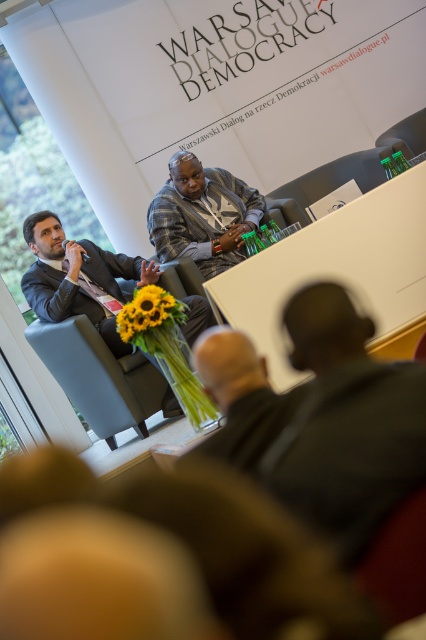
You are organizing a photo shoot for a fashion magazine and need to arrange two suits from the image. The matte black suit at left and the dark gray suit at center must be displayed side by side. Based on their sizes, which suit should be placed on the left to maintain a visually balanced arrangement?

The matte black suit at left should be placed on the left side since it is larger in size than the dark gray suit at center, creating a balanced visual arrangement.

You are an event organizer and need to place a name tag for the speaker at the Warsaw Dialogue Democracy event. The name tag should be placed directly in front of the speaker. According to the image, where should you place the name tag relative to the matte black suit at left?

The speaker is the person in the patterned blazer over a light colored shirt who is speaking or presenting. Since the matte black suit at left is positioned at point (77, 276), the name tag should be placed in front of the speaker, not the matte black suit at left.